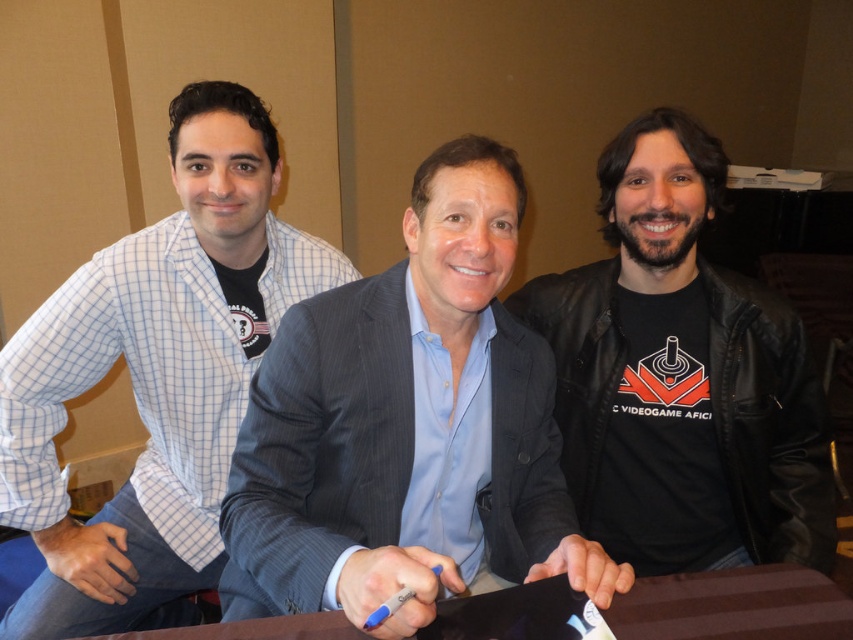
You are an attendee at this signing event. You want to place a name tag on the table between the white checkered shirt at left and the blue plastic pen at center. If the name tag is 10 inches wide, will it fit without overlapping either object?

The distance between the white checkered shirt at left and the blue plastic pen at center is 30.94 inches. Since the name tag is only 10 inches wide, there is enough space to place it between them without overlapping either object.

You are attending a signing event and see the blue shirt at center and the blue plastic pen at center. Which object is positioned to the right of the other?

The blue shirt at center is to the right of the blue plastic pen at center.

You are standing in front of the signing event table. You see a point marked at coordinates (155, 376). Which object is this point located on?

The point at (155, 376) is located on the white checkered shirt at left.